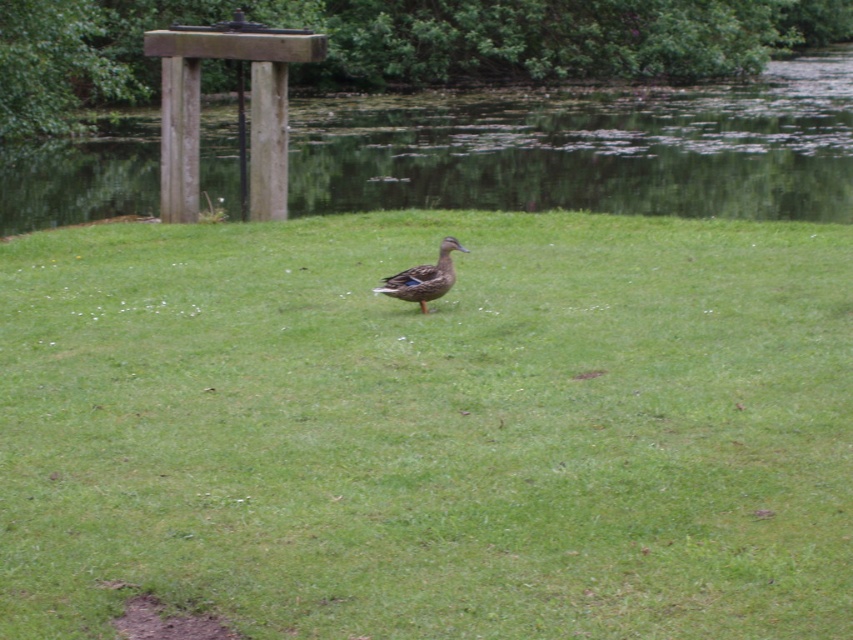
Can you confirm if green grassy at center is positioned above green grassy field at lower center?

Incorrect, green grassy at center is not positioned above green grassy field at lower center.

Based on the photo, does green grassy at center have a larger size compared to green grassy field at lower center?

No.

What are the coordinates of `green grassy at center` in the screenshot? It's located at (430, 428).

Where is `green grassy at center`? green grassy at center is located at coordinates (430, 428).

Can you confirm if green grassy at center is bigger than shiny brown duck at center?

Yes.

Who is higher up, green grassy at center or shiny brown duck at center?

shiny brown duck at center is above.

What are the coordinates of `green grassy at center` in the screenshot? It's located at (430, 428).

Can you confirm if green grassy field at lower center is positioned below shiny brown duck at center?

No.

Does green grassy field at lower center have a larger size compared to shiny brown duck at center?

Correct, green grassy field at lower center is larger in size than shiny brown duck at center.

Is point (309, 140) positioned in front of point (440, 262)?

No.

Find the location of a particular element. This screenshot has width=853, height=640. green grassy field at lower center is located at coordinates (589, 148).